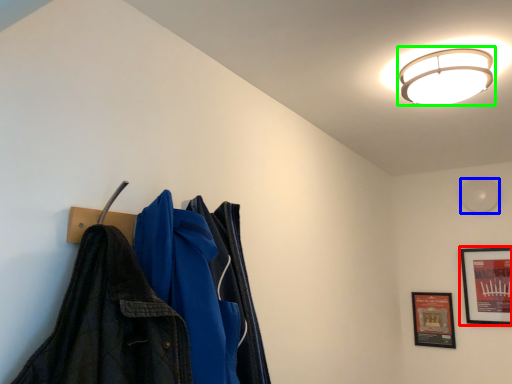
Question: Based on their relative distances, which object is farther from picture frame (highlighted by a red box)? Choose from light (highlighted by a blue box) and lamp (highlighted by a green box).

Choices:
 (A) light
 (B) lamp

Answer: (B)